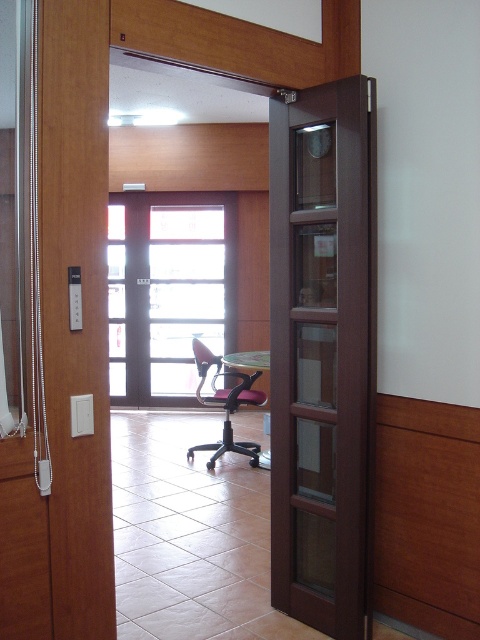
Question: Which point is closer to the camera taking this photo?

Choices:
 (A) (355, 92)
 (B) (156, 216)

Answer: (A)

Question: Among these points, which one is nearest to the camera?

Choices:
 (A) (226, 250)
 (B) (316, 108)
 (C) (207, 349)

Answer: (B)

Question: Does dark wood screen door at right have a lesser width compared to clear glass door at center?

Choices:
 (A) yes
 (B) no

Answer: (A)

Question: Does dark wood screen door at right appear on the right side of clear glass door at center?

Choices:
 (A) yes
 (B) no

Answer: (A)

Question: Which point is farther to the camera?

Choices:
 (A) (218, 356)
 (B) (334, 468)

Answer: (A)

Question: Can you confirm if dark wood screen door at right is positioned above pink fabric chair at center?

Choices:
 (A) yes
 (B) no

Answer: (A)